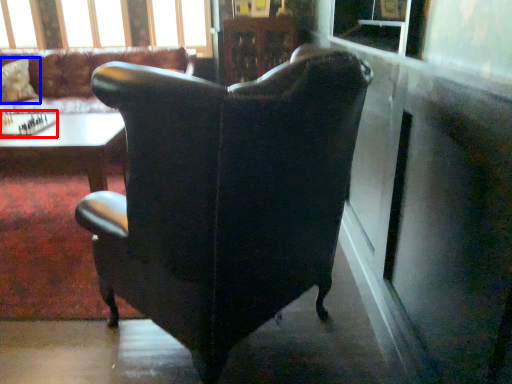
Question: Which object appears farthest to the camera in this image, board game (highlighted by a red box) or pillow (highlighted by a blue box)?

Choices:
 (A) board game
 (B) pillow

Answer: (B)